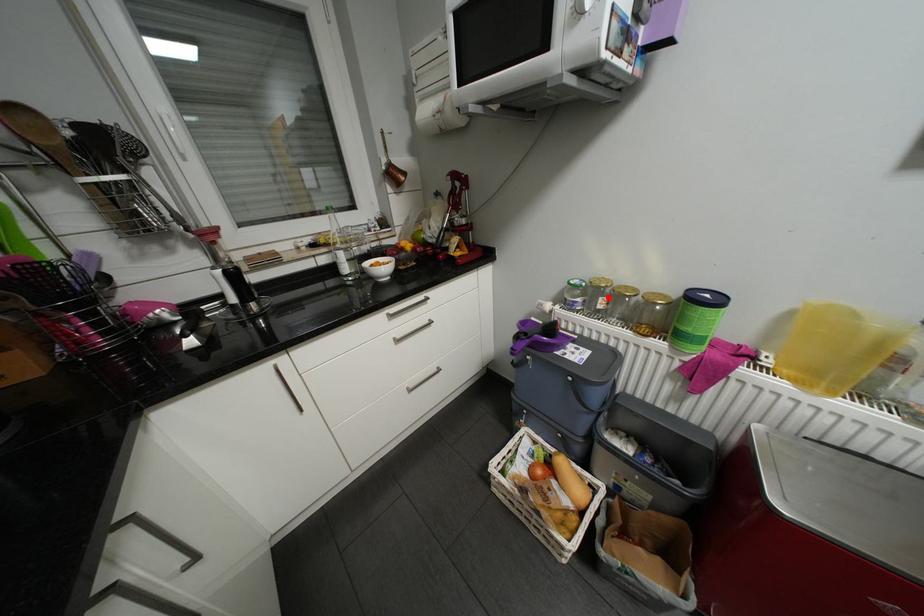
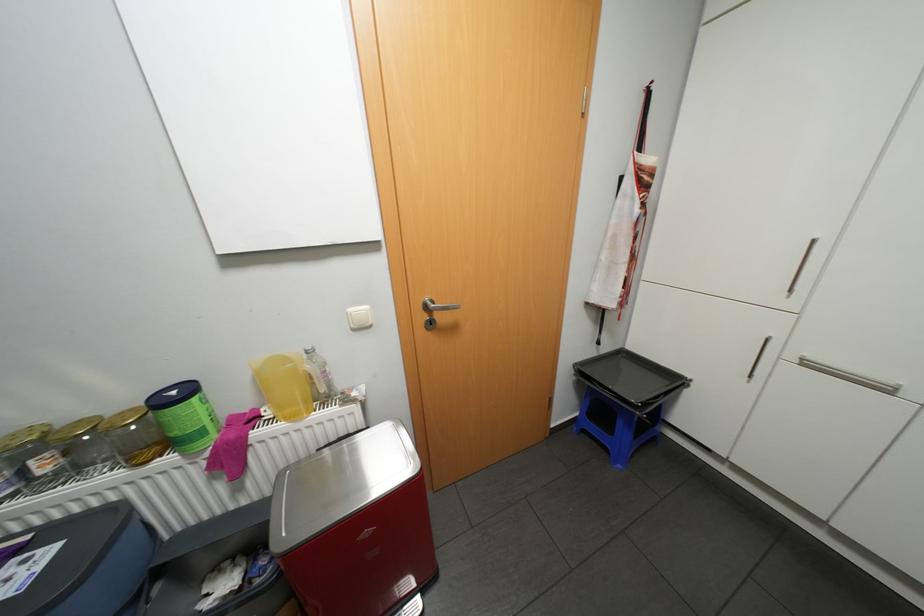
The point at the highlighted location is marked in the first image. Where is the corresponding point in the second image?

(39, 461)